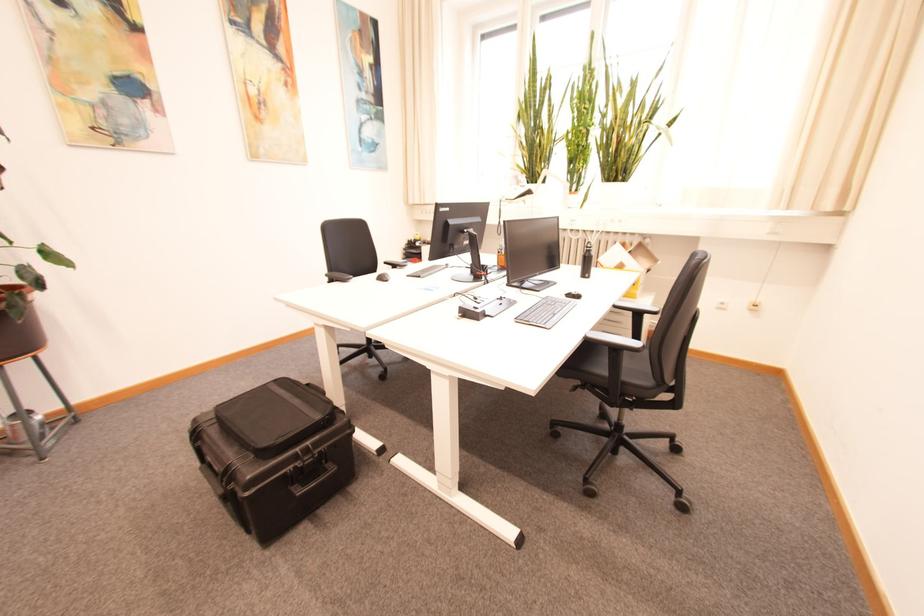
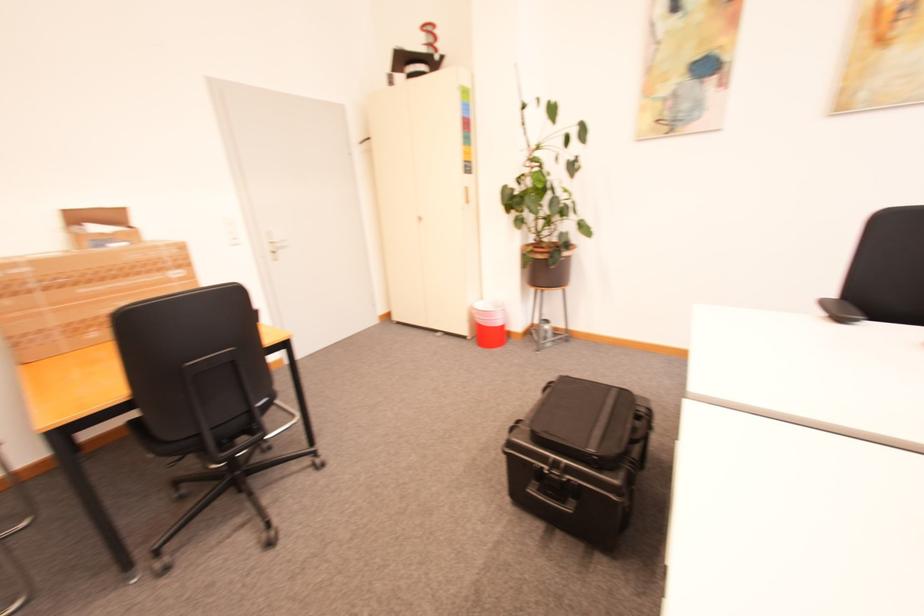
From the picture: How did the camera likely rotate?

The rotation direction of the camera is left-down.